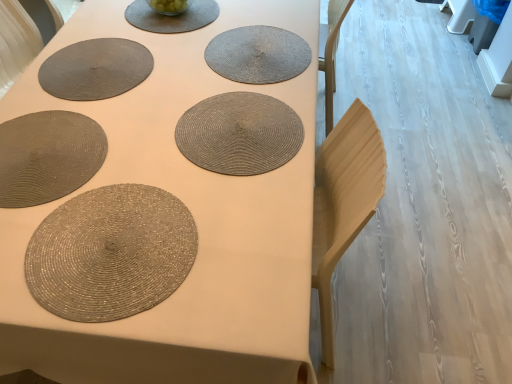
You are a GUI agent. You are given a task and a screenshot of the screen. Output one action in this format:
    pyautogui.click(x=<x>, y=<y>)
    Task: Click on the vacant space behind rattan placemat at lower left, which appears as the second paper plate when viewed from the front
    The height and width of the screenshot is (384, 512).
    Given the screenshot: What is the action you would take?
    pyautogui.click(x=82, y=95)